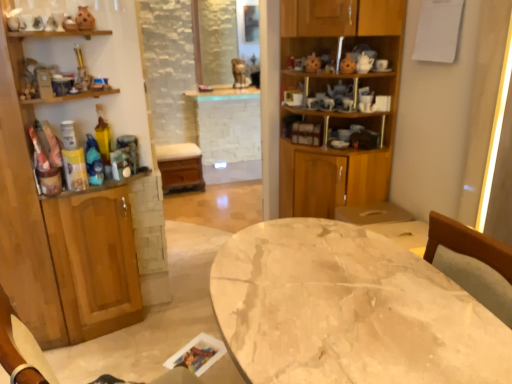
Question: Considering the relative sizes of wooden cabinet at left, which is the 2th cabinetry from right to left, and wooden cabinet at center, which is counted as the second cabinetry, starting from the left, in the image provided, is wooden cabinet at left, which is the 2th cabinetry from right to left, shorter than wooden cabinet at center, which is counted as the second cabinetry, starting from the left,?

Choices:
 (A) no
 (B) yes

Answer: (A)

Question: Is wooden cabinet at center, the 1th cabinetry when ordered from right to left, inside wooden cabinet at left, which is the 2th cabinetry from right to left?

Choices:
 (A) no
 (B) yes

Answer: (A)

Question: Can you confirm if wooden cabinet at left, which is the 1th cabinetry in left-to-right order, is smaller than wooden cabinet at center, the 1th cabinetry when ordered from right to left?

Choices:
 (A) no
 (B) yes

Answer: (B)

Question: Considering the relative sizes of wooden cabinet at left, which is the 1th cabinetry in left-to-right order, and wooden cabinet at center, the 1th cabinetry when ordered from right to left, in the image provided, is wooden cabinet at left, which is the 1th cabinetry in left-to-right order, thinner than wooden cabinet at center, the 1th cabinetry when ordered from right to left,?

Choices:
 (A) no
 (B) yes

Answer: (B)

Question: Is wooden cabinet at left, which is the 2th cabinetry from right to left, positioned beyond the bounds of wooden cabinet at center, which is counted as the second cabinetry, starting from the left?

Choices:
 (A) yes
 (B) no

Answer: (A)

Question: Is wooden cabinet at left, which is the 2th cabinetry from right to left, wider or thinner than wooden cabinet at center, the 1th cabinetry when ordered from right to left?

Choices:
 (A) thin
 (B) wide

Answer: (A)

Question: Based on their sizes in the image, would you say wooden cabinet at left, which is the 2th cabinetry from right to left, is bigger or smaller than wooden cabinet at center, the 1th cabinetry when ordered from right to left?

Choices:
 (A) small
 (B) big

Answer: (A)

Question: Would you say wooden cabinet at left, which is the 2th cabinetry from right to left, is to the left or to the right of wooden cabinet at center, which is counted as the second cabinetry, starting from the left, in the picture?

Choices:
 (A) left
 (B) right

Answer: (A)

Question: Which is correct: wooden cabinet at left, which is the 1th cabinetry in left-to-right order, is inside wooden cabinet at center, the 1th cabinetry when ordered from right to left, or outside of it?

Choices:
 (A) outside
 (B) inside

Answer: (A)

Question: From the image's perspective, is wooden cabinet at center, the 1th cabinetry when ordered from right to left, positioned above or below wooden cabinet at left, which is the 2th cabinetry from right to left?

Choices:
 (A) below
 (B) above

Answer: (B)

Question: Is wooden cabinet at center, which is counted as the second cabinetry, starting from the left, wider or thinner than wooden cabinet at left, which is the 2th cabinetry from right to left?

Choices:
 (A) thin
 (B) wide

Answer: (B)

Question: Is wooden cabinet at center, which is counted as the second cabinetry, starting from the left, bigger or smaller than wooden cabinet at left, which is the 1th cabinetry in left-to-right order?

Choices:
 (A) big
 (B) small

Answer: (A)

Question: Is wooden cabinet at center, the 1th cabinetry when ordered from right to left, in front of or behind wooden cabinet at left, which is the 1th cabinetry in left-to-right order, in the image?

Choices:
 (A) front
 (B) behind

Answer: (B)

Question: From their relative heights in the image, would you say wooden cabinet at left, which is the 1th cabinetry in left-to-right order, is taller or shorter than marble table at center?

Choices:
 (A) short
 (B) tall

Answer: (B)

Question: Which is correct: wooden cabinet at left, which is the 1th cabinetry in left-to-right order, is inside marble table at center, or outside of it?

Choices:
 (A) inside
 (B) outside

Answer: (B)